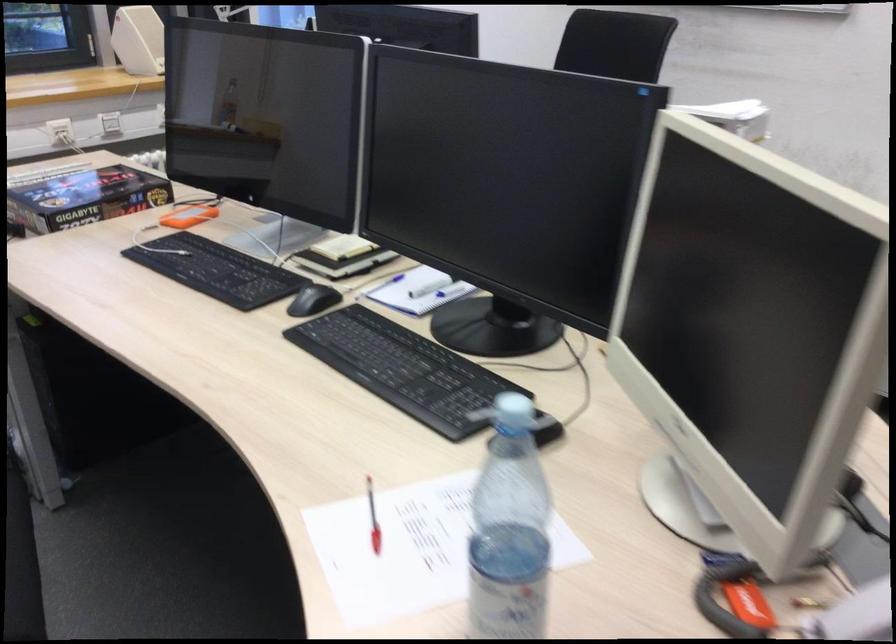
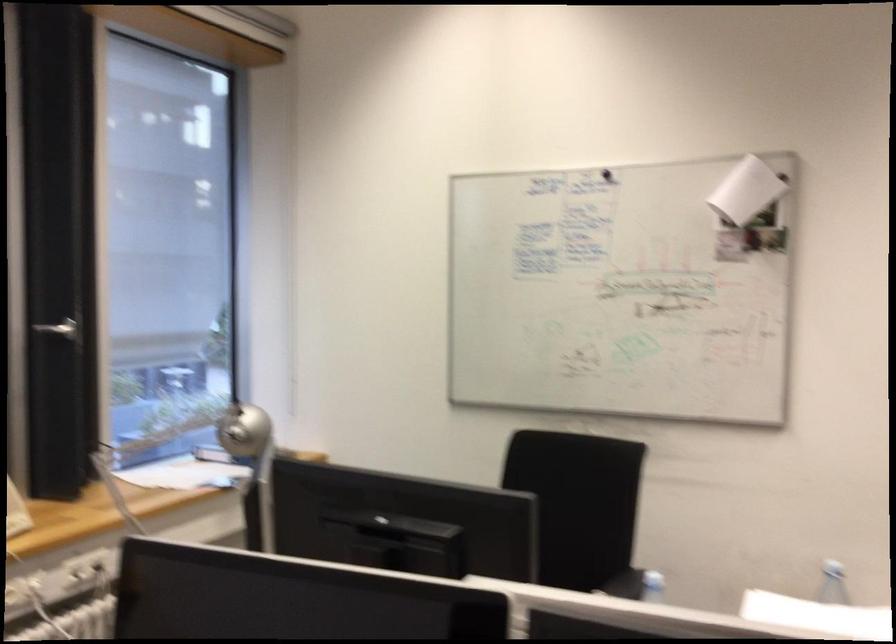
Consider the image. First-person continuous shooting, in which direction is the camera rotating?

The rotation direction of the camera is right-up.